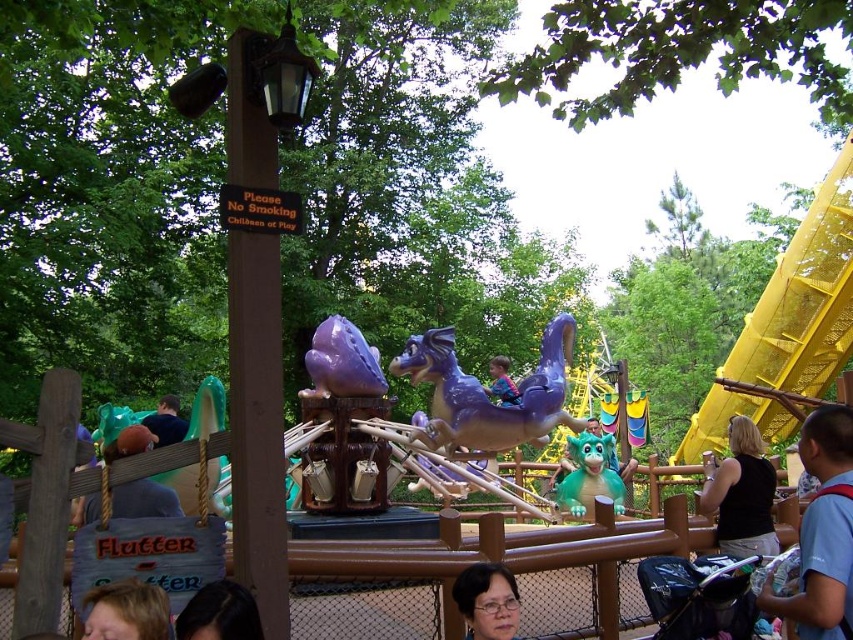
You are standing at the center of the theme park and see a point marked at coordinates (126,611). What object or feature is located at this point?

The point at coordinates (126,611) corresponds to the blonde hair at lower left.

You are a parent holding a baby and need to reach the ride with the purple dragon and green dinosaur figures before the park closes in 10 minutes. The black fabric stroller at lower right is currently 31 meters away from you. Can you make it on time if you walk at a normal pace?

The black fabric stroller at lower right is 31.00 meters away from the camera. Walking at a normal pace of about 1.4 meters per second, it would take approximately 22 seconds to cover 31 meters. Since you have 10 minutes, which is 600 seconds, you have plenty of time to reach the ride before the park closes.

You are a parent trying to locate your child who is playing near the purple plastic dragon at center. You are currently standing at the base of the yellow metallic slide at right. Which direction should you move to reach the dragon?

The yellow metallic slide at right is above the purple plastic dragon at center, so you should move downward from the slide to reach the dragon.